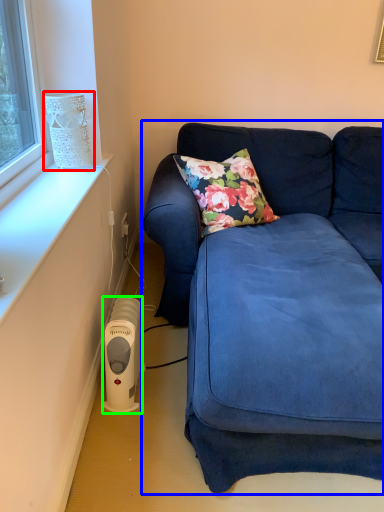
Question: Which object is the farthest from lamp (highlighted by a red box)? Choose among these: studio couch (highlighted by a blue box) or appliance (highlighted by a green box).

Choices:
 (A) studio couch
 (B) appliance

Answer: (A)